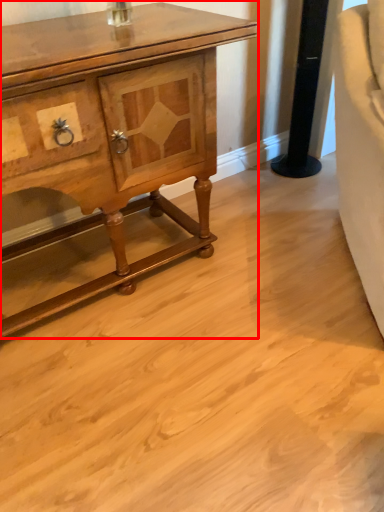
Question: Where is chest of drawers (annotated by the red box) located in relation to pillar in the image?

Choices:
 (A) right
 (B) left

Answer: (B)